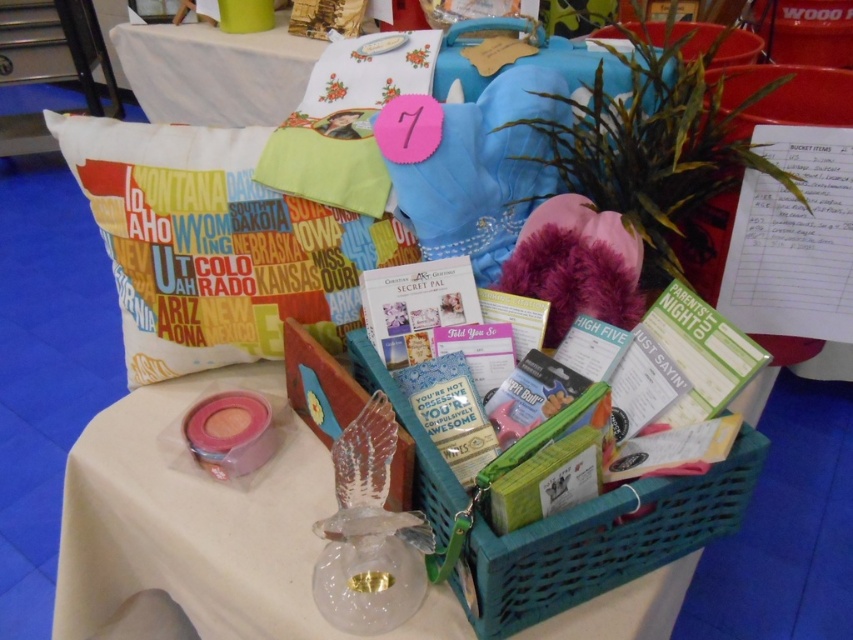
Who is positioned more to the left, teal plastic basket at center or white fabric tablecloth at upper center?

white fabric tablecloth at upper center

Is teal plastic basket at center below white fabric tablecloth at upper center?

Yes, teal plastic basket at center is below white fabric tablecloth at upper center.

Which is behind, point (360, 355) or point (119, 26)?

The point (119, 26) is more distant.

Identify the location of teal plastic basket at center. The width and height of the screenshot is (853, 640). (601, 541).

Looking at this image, is white fabric pillow at upper left smaller than white fabric tablecloth at upper center?

Yes, white fabric pillow at upper left is smaller than white fabric tablecloth at upper center.

You are a GUI agent. You are given a task and a screenshot of the screen. Output one action in this format:
    pyautogui.click(x=<x>, y=<y>)
    Task: Click on the white fabric pillow at upper left
    This screenshot has width=853, height=640.
    Given the screenshot: What is the action you would take?
    pyautogui.click(x=215, y=244)

Where is `white fabric pillow at upper left`? Image resolution: width=853 pixels, height=640 pixels. white fabric pillow at upper left is located at coordinates (215, 244).

Who is more forward, (123, 252) or (364, 342)?

Point (364, 342) is more forward.

Who is higher up, white fabric pillow at upper left or teal plastic basket at center?

white fabric pillow at upper left is higher up.

Identify the location of white fabric pillow at upper left. (215, 244).